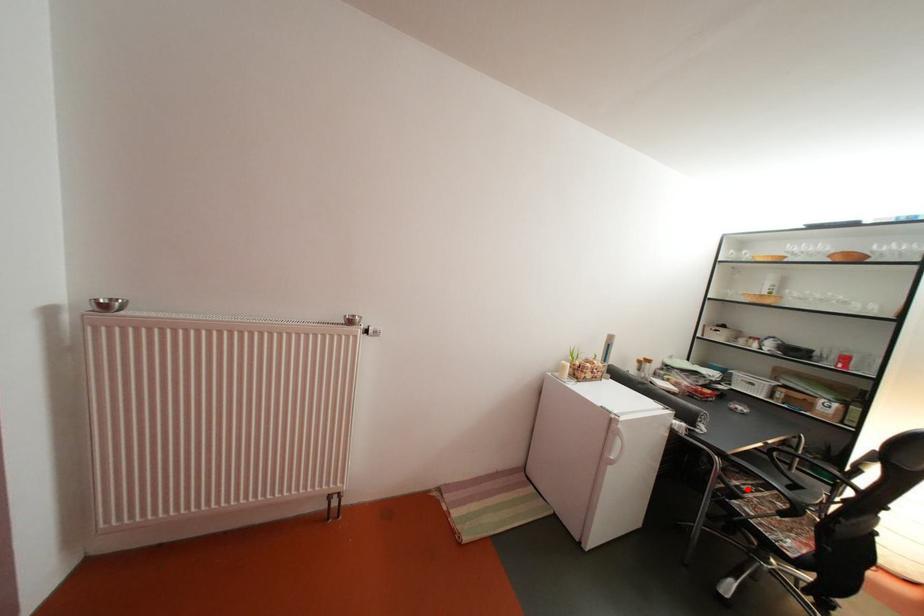
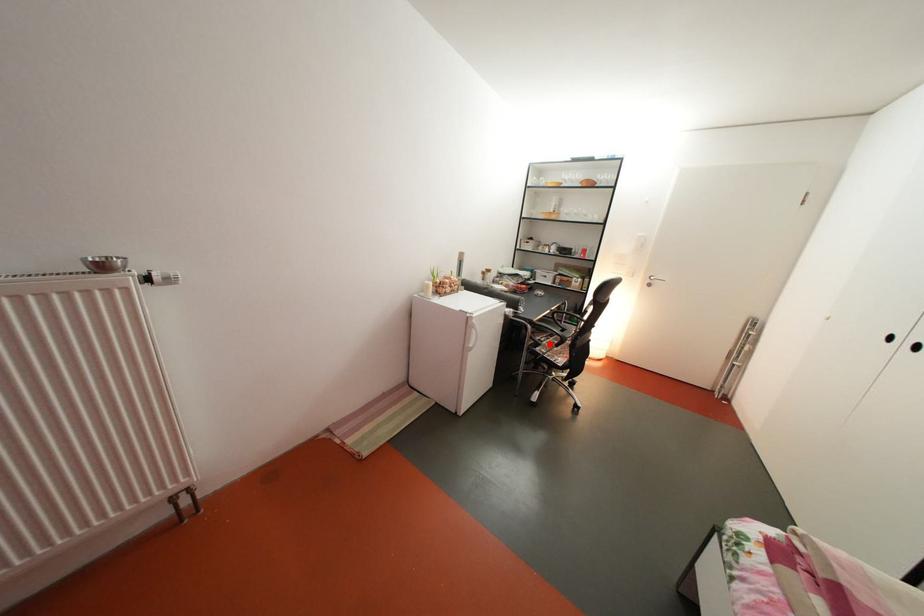
I am providing you with two images of the same scene from different viewpoints. A red point is marked on the first image and another point is marked on the second image. Are the points marked in image1 and image2 representing the same 3D position?

Yes